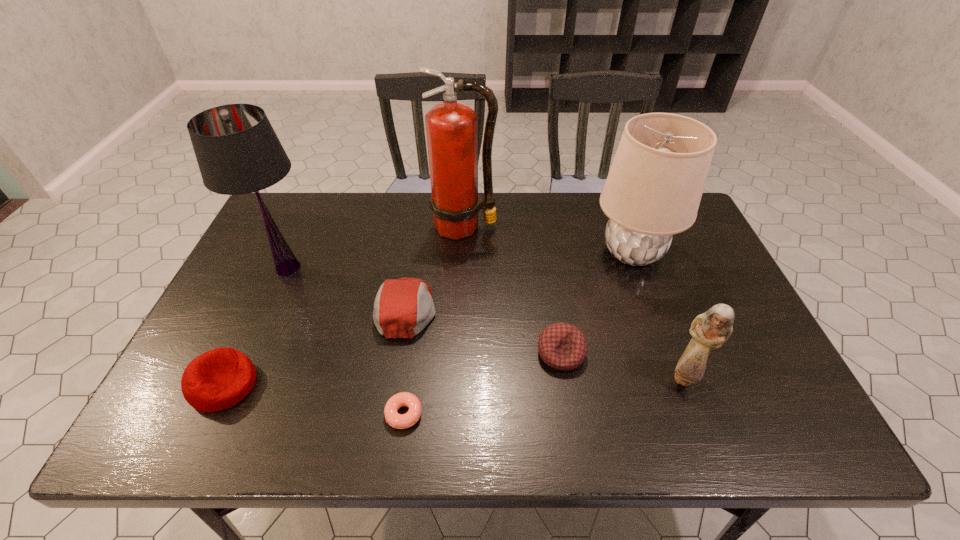
Where is `free space at the far left corner`? free space at the far left corner is located at coordinates (323, 210).

Find the location of a particular element. Image resolution: width=960 pixels, height=540 pixels. free spot at the near left corner of the desktop is located at coordinates point(236,409).

Where is `vacant region between the figurine and the taller beanbag`? The image size is (960, 540). vacant region between the figurine and the taller beanbag is located at coordinates (454, 381).

Identify the location of free space that is in between the third object from right to left and the doughnut. (483, 383).

The height and width of the screenshot is (540, 960). In order to click on vacant space in between the figurine and the shorter beanbag in this screenshot , I will do `click(622, 365)`.

Find the location of a particular element. Image resolution: width=960 pixels, height=540 pixels. free area in between the fire extinguisher and the right lampshade is located at coordinates 548,240.

Find the location of `unoccupied position between the right lampshade and the fire extinguisher`. unoccupied position between the right lampshade and the fire extinguisher is located at coordinates tap(548, 240).

I want to click on vacant region between the shorter beanbag and the figurine, so click(x=622, y=365).

This screenshot has width=960, height=540. In order to click on unoccupied area between the taller beanbag and the figurine in this screenshot , I will do `click(454, 381)`.

Identify the location of free point between the fire extinguisher and the shortest object. The height and width of the screenshot is (540, 960). coord(434,320).